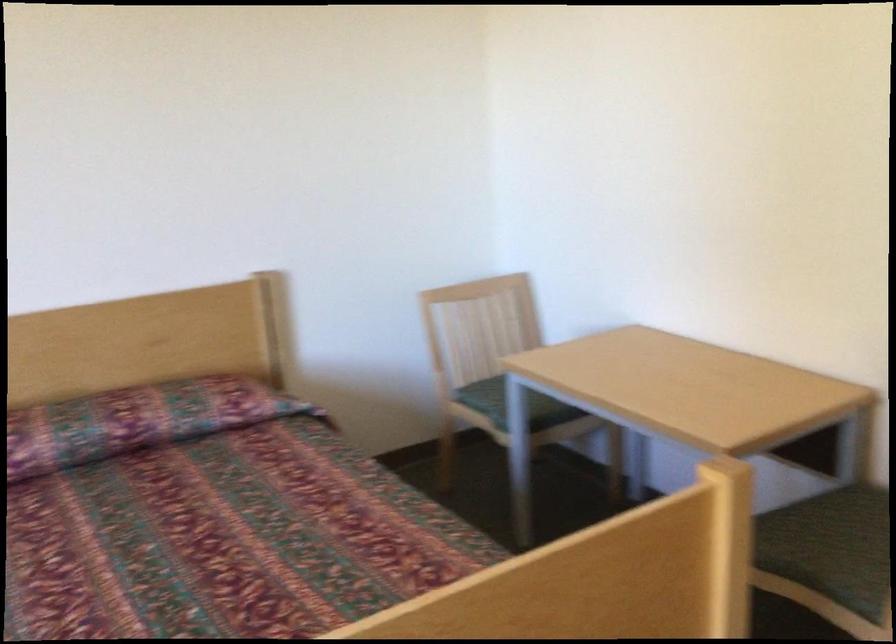
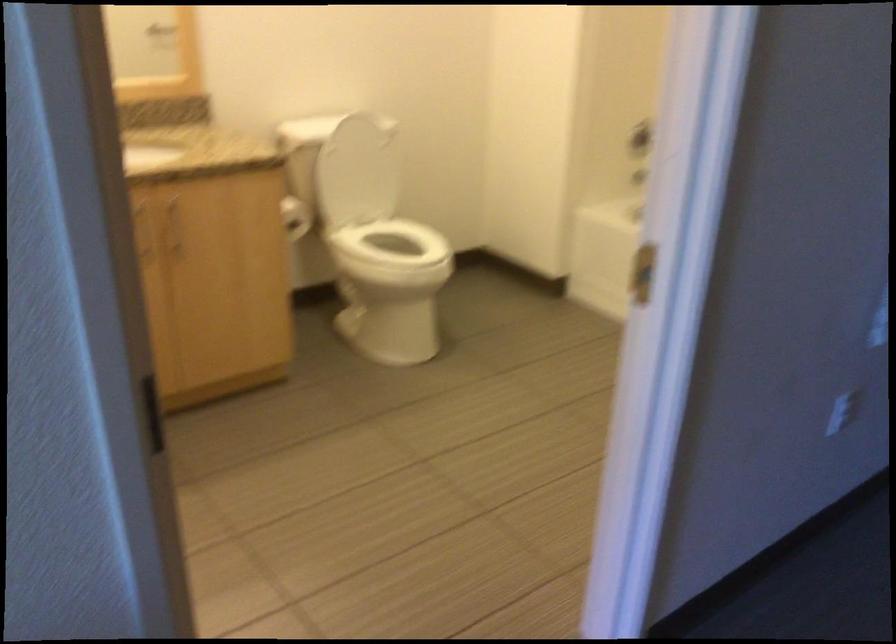
In a continuous first-person perspective shot, in which direction is the camera moving?

The cameraman moved toward right, forward.